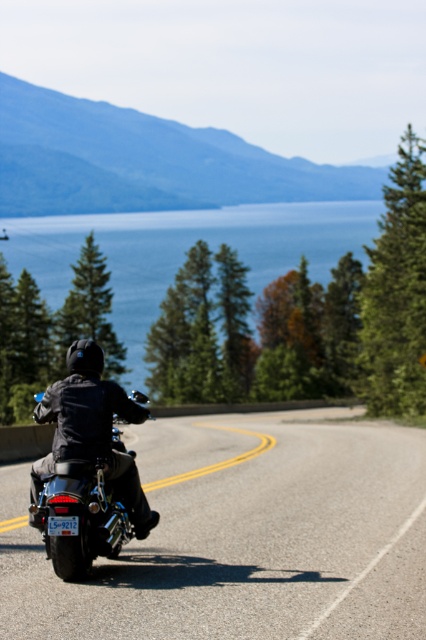
Who is more distant from viewer, [132,244] or [112,515]?

The point [132,244] is more distant.

Is blue water at center closer to camera compared to shiny chrome motorcycle at center?

No, blue water at center is behind shiny chrome motorcycle at center.

Who is more distant from viewer, [262,266] or [112,419]?

Positioned behind is point [262,266].

You are a GUI agent. You are given a task and a screenshot of the screen. Output one action in this format:
    pyautogui.click(x=<x>, y=<y>)
    Task: Click on the blue water at center
    The height and width of the screenshot is (640, 426).
    Given the screenshot: What is the action you would take?
    pyautogui.click(x=184, y=250)

Between point (291, 552) and point (63, 500), which one is positioned behind?

Positioned behind is point (291, 552).

Does black rubber motorcycle at center lie in front of shiny chrome motorcycle at center?

Yes, black rubber motorcycle at center is closer to the viewer.

Which is behind, point (9, 499) or point (68, 570)?

Positioned behind is point (9, 499).

This screenshot has width=426, height=640. Find the location of `black rubber motorcycle at center`. black rubber motorcycle at center is located at coordinates (242, 536).

At what (x,y) coordinates should I click in order to perform the action: click on black rubber motorcycle at center. Please return your answer as a coordinate pair (x, y). This screenshot has height=640, width=426. Looking at the image, I should click on (242, 536).

Between point (115, 593) and point (143, 312), which one is positioned behind?

Positioned behind is point (143, 312).

Describe the element at coordinates (242, 536) in the screenshot. I see `black rubber motorcycle at center` at that location.

Identify the location of black rubber motorcycle at center. coord(242,536).